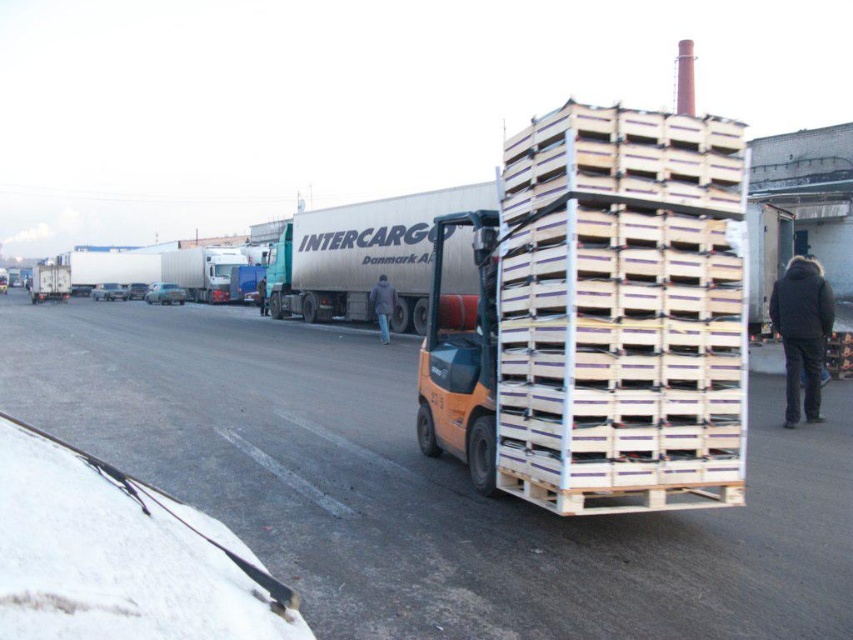
Question: Is silver metallic trailer truck at center thinner than dark gray fabric jacket at center?

Choices:
 (A) yes
 (B) no

Answer: (B)

Question: Which object appears farthest from the camera in this image?

Choices:
 (A) dark gray fabric jacket at center
 (B) silver metallic trailer truck at center

Answer: (A)

Question: Can you confirm if silver metallic trailer truck at center is positioned below dark gray fabric jacket at center?

Choices:
 (A) yes
 (B) no

Answer: (B)

Question: Can you confirm if silver metallic trailer truck at center is wider than dark gray fabric jacket at center?

Choices:
 (A) no
 (B) yes

Answer: (B)